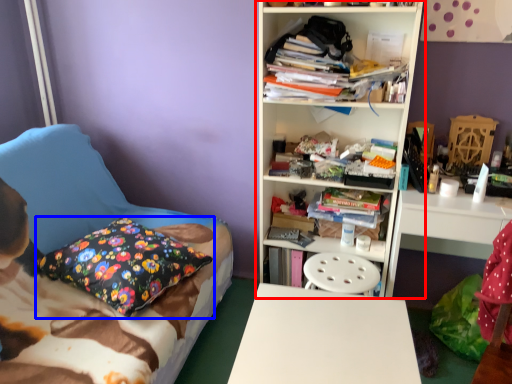
Question: Which object appears farthest to the camera in this image, bookcase (highlighted by a red box) or pillow (highlighted by a blue box)?

Choices:
 (A) bookcase
 (B) pillow

Answer: (A)